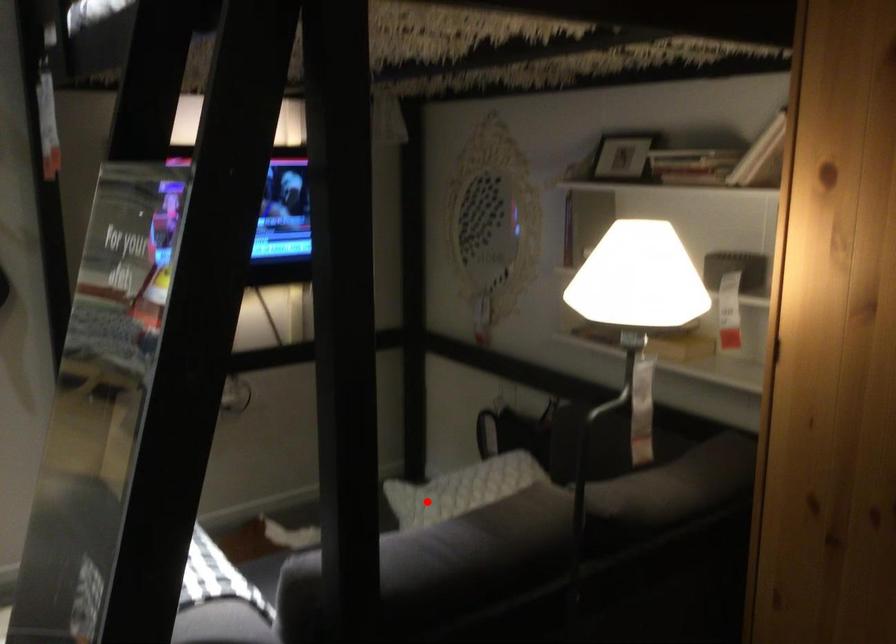
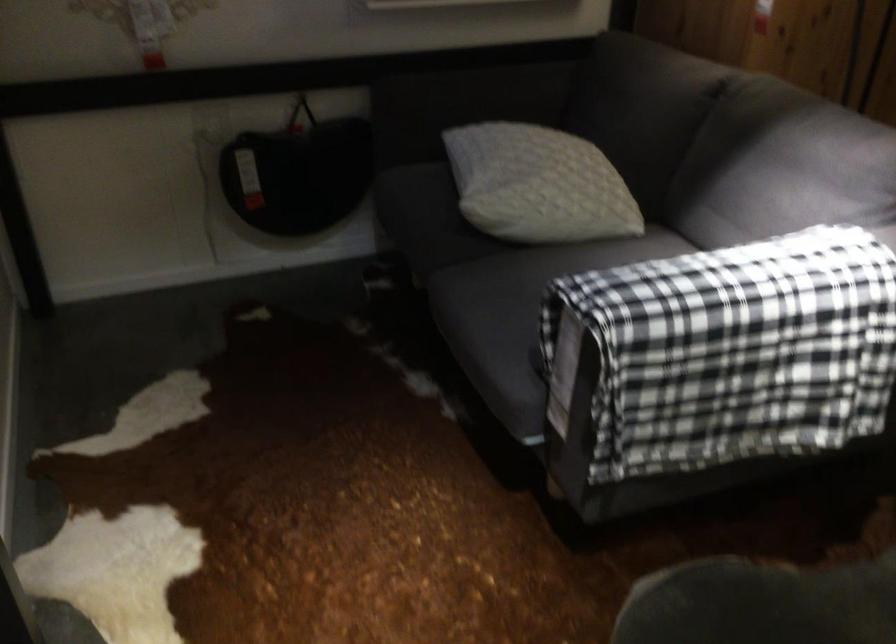
Locate, in the second image, the point that corresponds to the highlighted location in the first image.

(538, 185)